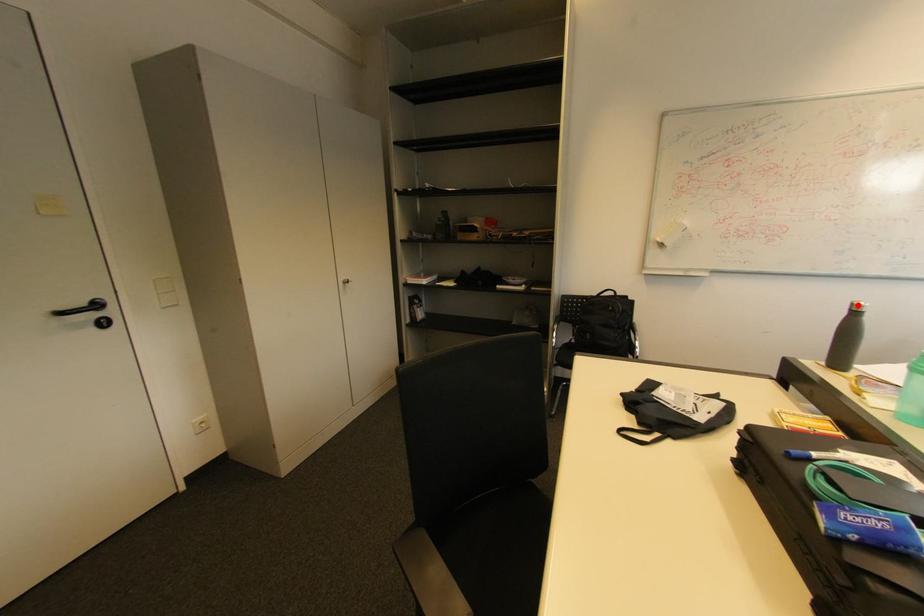
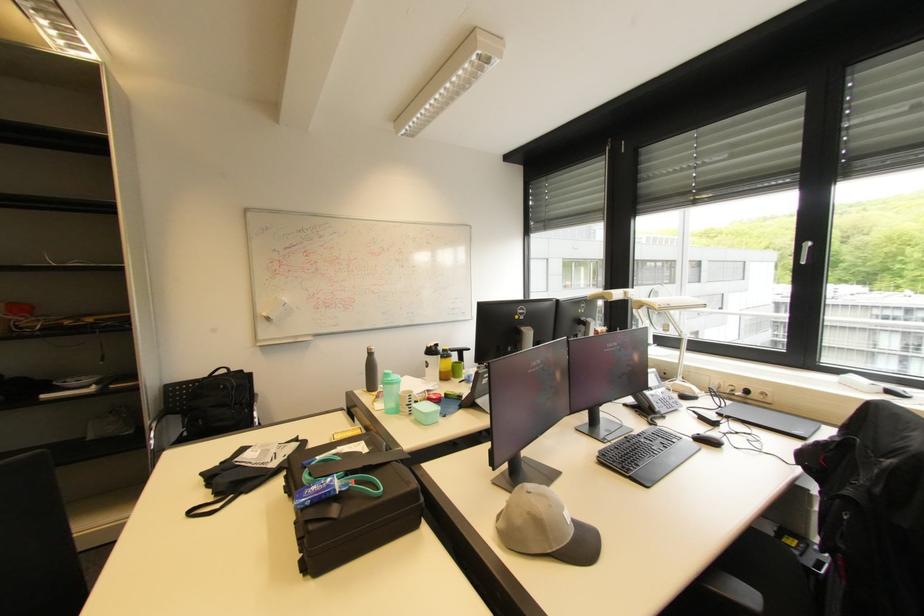
Find the pixel in the second image that matches the highlighted location in the first image.

(372, 350)